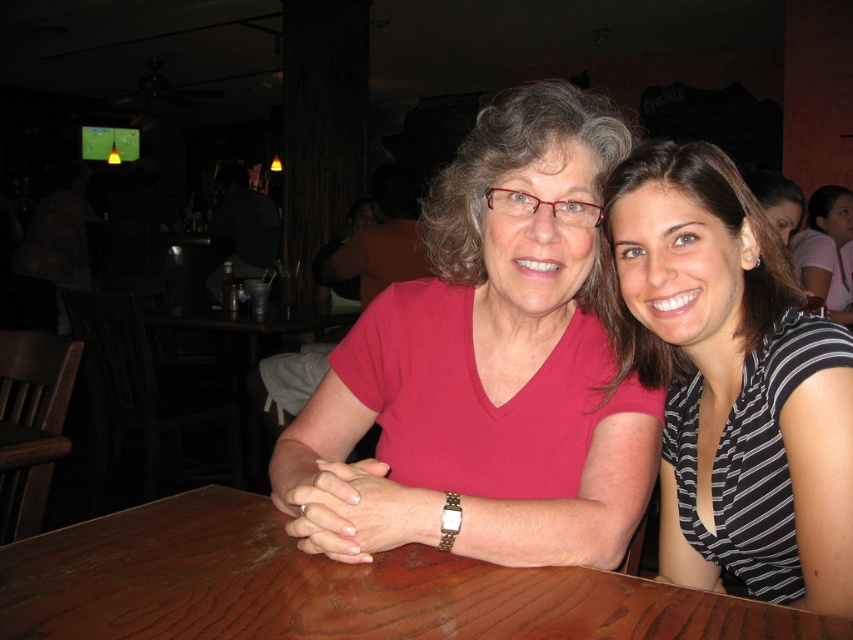
You are a photographer setting up for a group photo. You notice the striped fabric shirt at center and the brown wood table at center in the scene. Which object should you focus on first if you want to capture both in a single frame without adjusting your camera settings, considering their sizes?

The striped fabric shirt at center is bigger than the brown wood table at center, so you should focus on the striped fabric shirt at center first to ensure it is in sharp focus before capturing the entire scene.